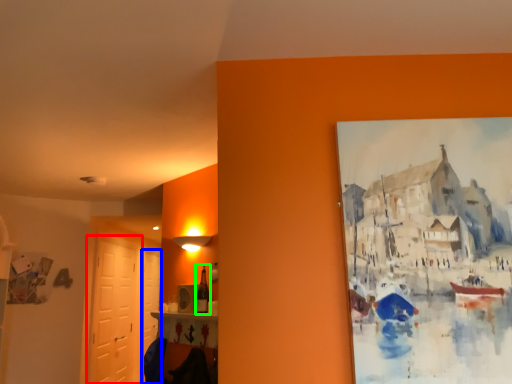
Question: Which is farther away from door (highlighted by a red box)? door (highlighted by a blue box) or bottle (highlighted by a green box)?

Choices:
 (A) door
 (B) bottle

Answer: (B)